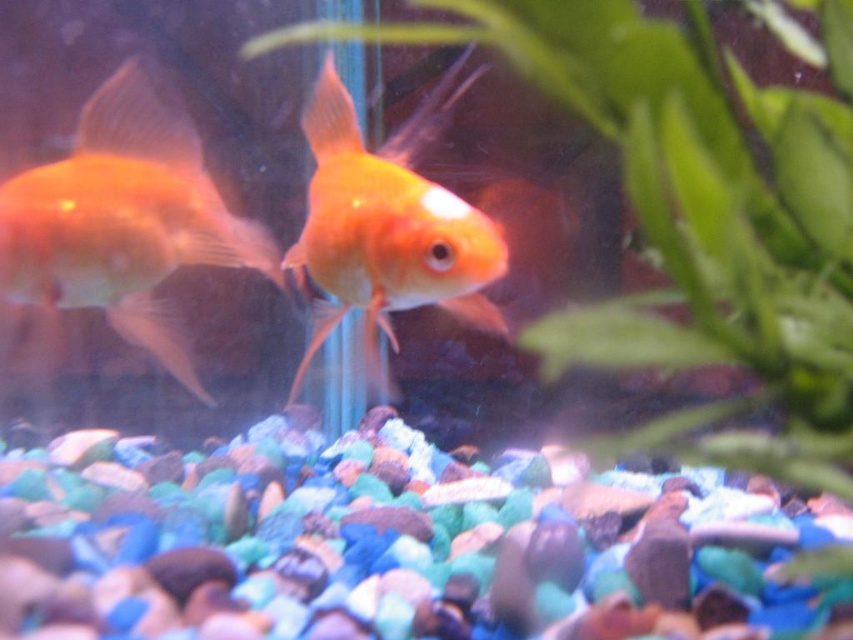
Can you confirm if green leafy plant at center is positioned above shiny orange fish at center?

Yes.

Consider the image. Does green leafy plant at center appear on the left side of shiny orange fish at center?

In fact, green leafy plant at center is to the right of shiny orange fish at center.

The height and width of the screenshot is (640, 853). Identify the location of green leafy plant at center. (695, 218).

Between point (786, 125) and point (39, 243), which one is positioned in front?

Point (786, 125) is in front.

Who is more forward, (663, 28) or (35, 196)?

Point (663, 28)

Where is `green leafy plant at center`? This screenshot has width=853, height=640. green leafy plant at center is located at coordinates (695, 218).

Is matte orange goldfish at left shorter than shiny orange fish at center?

Correct, matte orange goldfish at left is not as tall as shiny orange fish at center.

Between point (90, 161) and point (311, 113), which one is positioned behind?

Point (311, 113)

The image size is (853, 640). What are the coordinates of `matte orange goldfish at left` in the screenshot? It's located at (123, 220).

The image size is (853, 640). Identify the location of matte orange goldfish at left. (123, 220).